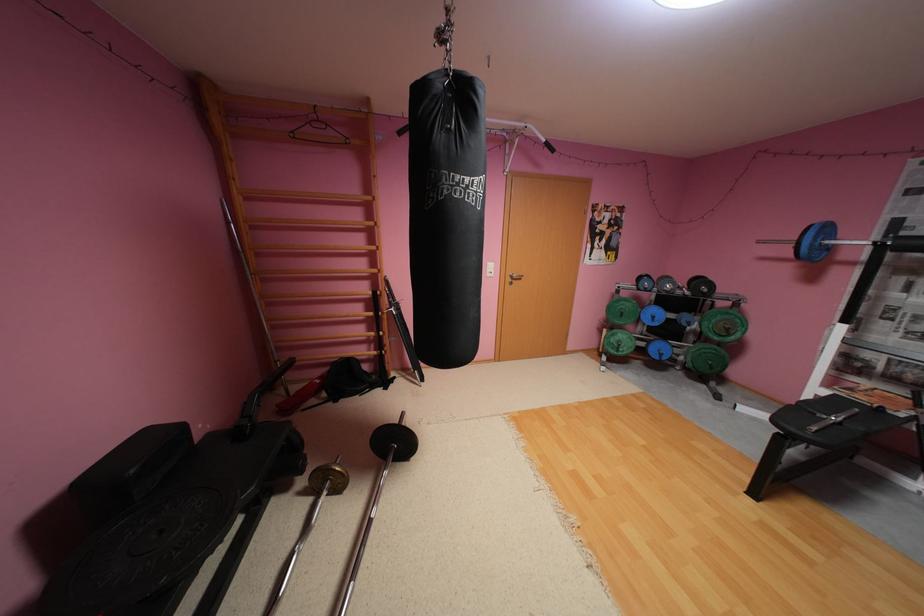
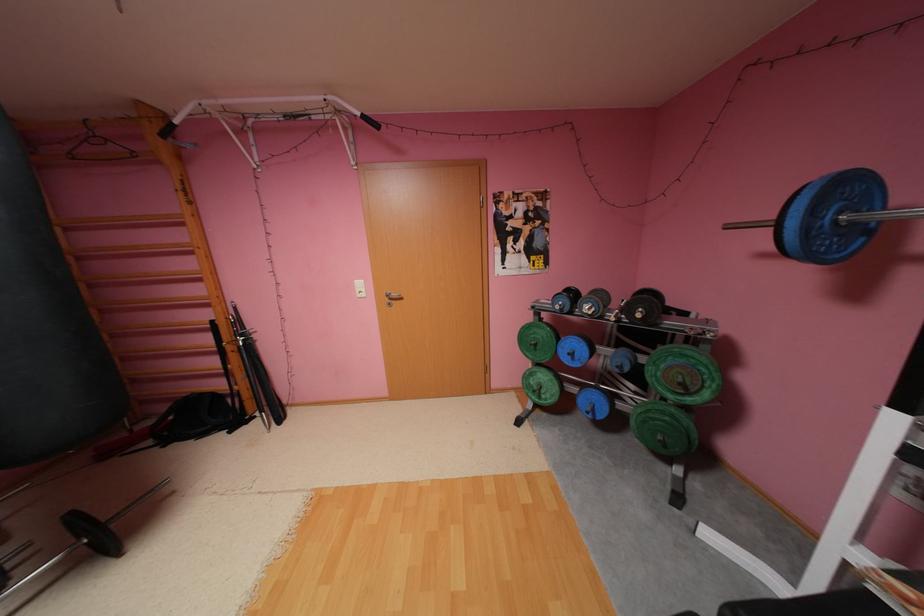
Where in the second image is the point corresponding to (x=821, y=246) from the first image?

(816, 229)